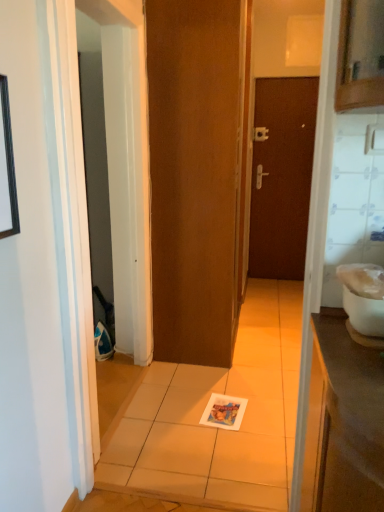
Question: Considering the positions of brown matte door at center, the 2th door in the front-to-back sequence, and white glossy toilet bowl at right in the image, is brown matte door at center, the 2th door in the front-to-back sequence, bigger or smaller than white glossy toilet bowl at right?

Choices:
 (A) small
 (B) big

Answer: (B)

Question: Considering the positions of brown matte door at center, the 2th door in the front-to-back sequence, and white glossy toilet bowl at right in the image, is brown matte door at center, the 2th door in the front-to-back sequence, taller or shorter than white glossy toilet bowl at right?

Choices:
 (A) short
 (B) tall

Answer: (B)

Question: Based on their relative distances, which object is nearer to the silver metallic door handle at center?

Choices:
 (A) black matte picture frame at upper left
 (B) brown matte door at center, which is the second door from right to left
 (C) brown matte door at center, placed as the 1th door when sorted from right to left
 (D) matte paper magazine at center
 (E) white glossy toilet bowl at right

Answer: (C)

Question: Considering the real-world distances, which object is closest to the brown matte door at center, which is the second door from right to left?

Choices:
 (A) black matte picture frame at upper left
 (B) matte paper magazine at center
 (C) brown matte door at center, the 2th door in the front-to-back sequence
 (D) white glossy toilet bowl at right
 (E) silver metallic door handle at center

Answer: (B)